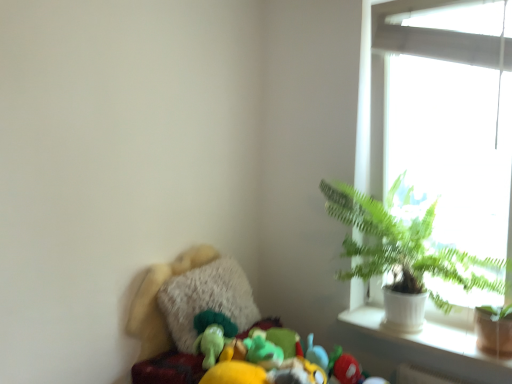
Question: Is green leafy plant at upper right far from white ceramic pot at right?

Choices:
 (A) yes
 (B) no

Answer: (B)

Question: Is green leafy plant at upper right behind white ceramic pot at right?

Choices:
 (A) yes
 (B) no

Answer: (B)

Question: Is green leafy plant at upper right bigger than white ceramic pot at right?

Choices:
 (A) yes
 (B) no

Answer: (A)

Question: Can you confirm if green leafy plant at upper right is thinner than white ceramic pot at right?

Choices:
 (A) no
 (B) yes

Answer: (A)

Question: From a real-world perspective, is green leafy plant at upper right positioned over white ceramic pot at right based on gravity?

Choices:
 (A) yes
 (B) no

Answer: (A)

Question: From a real-world perspective, is white ceramic pot at right physically located above or below green leafy plant at upper right?

Choices:
 (A) above
 (B) below

Answer: (B)

Question: Is white ceramic pot at right inside the boundaries of green leafy plant at upper right, or outside?

Choices:
 (A) inside
 (B) outside

Answer: (A)

Question: From their relative heights in the image, would you say white ceramic pot at right is taller or shorter than green leafy plant at upper right?

Choices:
 (A) tall
 (B) short

Answer: (B)

Question: In the image, is white ceramic pot at right positioned in front of or behind green leafy plant at upper right?

Choices:
 (A) behind
 (B) front

Answer: (A)

Question: Considering the positions of point (498, 302) and point (478, 256), is point (498, 302) closer or farther from the camera than point (478, 256)?

Choices:
 (A) farther
 (B) closer

Answer: (B)

Question: Is white glass window at upper right bigger or smaller than green leafy plant at upper right?

Choices:
 (A) big
 (B) small

Answer: (B)

Question: From a real-world perspective, is white glass window at upper right above or below green leafy plant at upper right?

Choices:
 (A) below
 (B) above

Answer: (B)

Question: Is white glass window at upper right inside or outside of green leafy plant at upper right?

Choices:
 (A) inside
 (B) outside

Answer: (A)

Question: Looking at the image, does green leafy plant at upper right seem bigger or smaller compared to white ceramic pot at upper right?

Choices:
 (A) small
 (B) big

Answer: (B)

Question: Considering the relative positions of green leafy plant at upper right and white ceramic pot at upper right in the image provided, is green leafy plant at upper right to the left or to the right of white ceramic pot at upper right?

Choices:
 (A) right
 (B) left

Answer: (B)